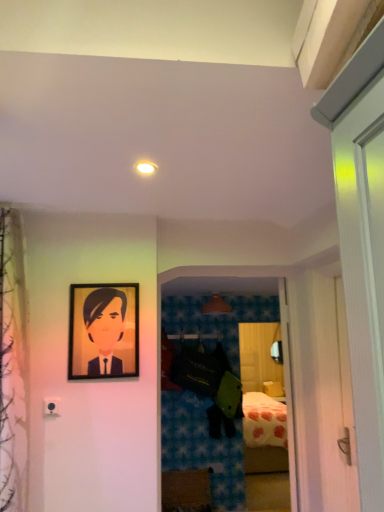
Question: From the image's perspective, is wooden chest of drawers at lower center located beneath matte brown lampshade at center?

Choices:
 (A) yes
 (B) no

Answer: (A)

Question: From a real-world perspective, does wooden chest of drawers at lower center stand above matte brown lampshade at center?

Choices:
 (A) yes
 (B) no

Answer: (B)

Question: Does wooden chest of drawers at lower center have a lesser height compared to matte brown lampshade at center?

Choices:
 (A) no
 (B) yes

Answer: (A)

Question: Is wooden chest of drawers at lower center at the left side of matte brown lampshade at center?

Choices:
 (A) yes
 (B) no

Answer: (A)

Question: Is wooden chest of drawers at lower center beside matte brown lampshade at center?

Choices:
 (A) yes
 (B) no

Answer: (B)

Question: Is wooden chest of drawers at lower center in front of or behind matte black portrait at upper left in the image?

Choices:
 (A) front
 (B) behind

Answer: (B)

Question: Is wooden chest of drawers at lower center taller or shorter than matte black portrait at upper left?

Choices:
 (A) short
 (B) tall

Answer: (A)

Question: Is wooden chest of drawers at lower center bigger or smaller than matte black portrait at upper left?

Choices:
 (A) big
 (B) small

Answer: (A)

Question: In the image, is wooden chest of drawers at lower center on the left side or the right side of matte black portrait at upper left?

Choices:
 (A) right
 (B) left

Answer: (A)

Question: In the image, is wooden chest of drawers at lower center positioned in front of or behind matte white light fixture at upper center?

Choices:
 (A) behind
 (B) front

Answer: (A)

Question: From the image's perspective, is wooden chest of drawers at lower center above or below matte white light fixture at upper center?

Choices:
 (A) below
 (B) above

Answer: (A)

Question: Does point (203, 485) appear closer or farther from the camera than point (147, 168)?

Choices:
 (A) farther
 (B) closer

Answer: (A)

Question: In terms of size, does wooden chest of drawers at lower center appear bigger or smaller than matte white light fixture at upper center?

Choices:
 (A) small
 (B) big

Answer: (B)

Question: Looking at the image, does matte brown lampshade at center seem bigger or smaller compared to wooden chest of drawers at lower center?

Choices:
 (A) small
 (B) big

Answer: (A)

Question: Is point (226, 305) closer or farther from the camera than point (200, 470)?

Choices:
 (A) farther
 (B) closer

Answer: (A)